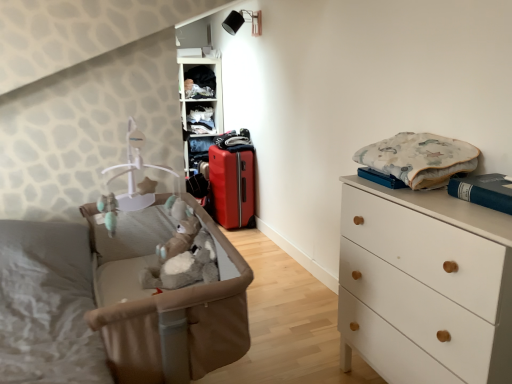
Question: Is white matte chest of drawers at right beside matte red suitcase at center?

Choices:
 (A) yes
 (B) no

Answer: (B)

Question: Would you say white matte chest of drawers at right is a long distance from matte red suitcase at center?

Choices:
 (A) no
 (B) yes

Answer: (B)

Question: From the image's perspective, is white matte chest of drawers at right located beneath matte red suitcase at center?

Choices:
 (A) yes
 (B) no

Answer: (A)

Question: Is white matte chest of drawers at right not inside matte red suitcase at center?

Choices:
 (A) yes
 (B) no

Answer: (A)

Question: Is white matte chest of drawers at right wider than matte red suitcase at center?

Choices:
 (A) yes
 (B) no

Answer: (A)

Question: Considering the relative positions of dark blue fabric at upper center, the 1th clothing positioned from the top, and fluffy cotton blanket at upper right, the first clothing in the bottom-to-top sequence, in the image provided, is dark blue fabric at upper center, the 1th clothing positioned from the top, to the left or to the right of fluffy cotton blanket at upper right, the first clothing in the bottom-to-top sequence,?

Choices:
 (A) left
 (B) right

Answer: (A)

Question: Is dark blue fabric at upper center, the 1th clothing positioned from the top, situated inside fluffy cotton blanket at upper right, positioned as the 1th clothing in front-to-back order, or outside?

Choices:
 (A) outside
 (B) inside

Answer: (A)

Question: Is point pos(199,87) positioned closer to the camera than point pos(417,140)?

Choices:
 (A) closer
 (B) farther

Answer: (B)

Question: Considering the positions of dark blue fabric at upper center, which ranks as the 1th clothing in left-to-right order, and fluffy cotton blanket at upper right, the 2th clothing in the left-to-right sequence, in the image, is dark blue fabric at upper center, which ranks as the 1th clothing in left-to-right order, bigger or smaller than fluffy cotton blanket at upper right, the 2th clothing in the left-to-right sequence,?

Choices:
 (A) small
 (B) big

Answer: (A)

Question: Is white matte chest of drawers at right inside the boundaries of fluffy cotton blanket at upper right, the 2th clothing in the left-to-right sequence, or outside?

Choices:
 (A) inside
 (B) outside

Answer: (B)

Question: From the image's perspective, is white matte chest of drawers at right positioned above or below fluffy cotton blanket at upper right, positioned as the 1th clothing in front-to-back order?

Choices:
 (A) above
 (B) below

Answer: (B)

Question: From a real-world perspective, is white matte chest of drawers at right above or below fluffy cotton blanket at upper right, which is counted as the 2th clothing, starting from the back?

Choices:
 (A) below
 (B) above

Answer: (A)

Question: Would you say white matte chest of drawers at right is to the left or to the right of fluffy cotton blanket at upper right, the 2th clothing in the left-to-right sequence, in the picture?

Choices:
 (A) right
 (B) left

Answer: (A)

Question: Would you say matte plastic shelf at upper center, which is the second shelf in top-to-bottom order, is to the left or to the right of brown fabric infant bed at left in the picture?

Choices:
 (A) right
 (B) left

Answer: (B)

Question: In the image, is matte plastic shelf at upper center, which is the second shelf in top-to-bottom order, positioned in front of or behind brown fabric infant bed at left?

Choices:
 (A) front
 (B) behind

Answer: (B)